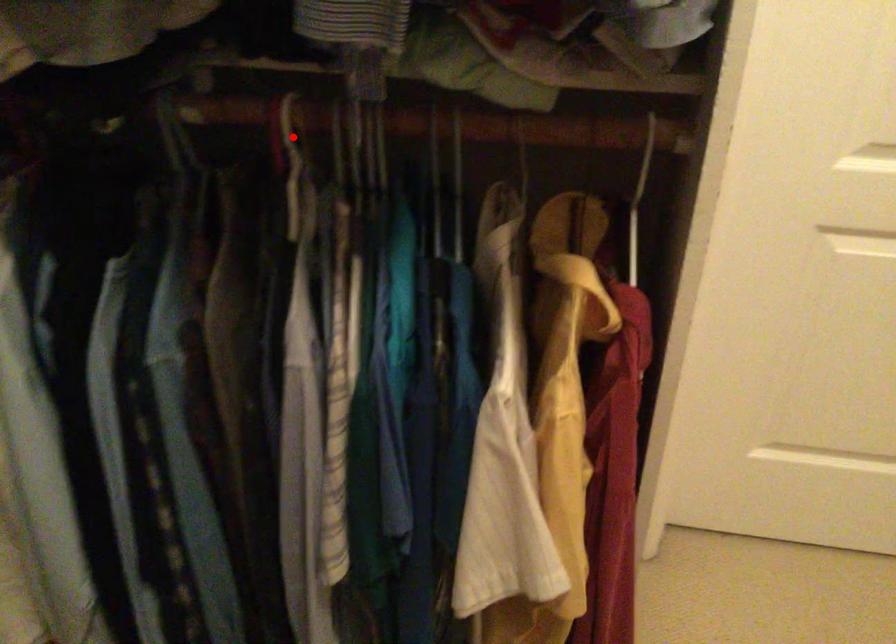
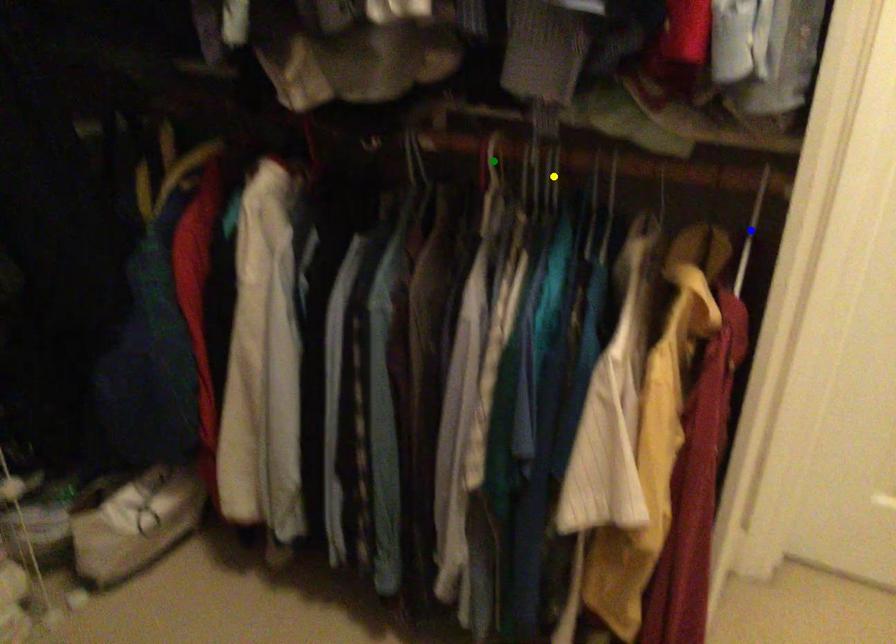
Question: I am providing you with two images of the same scene from different viewpoints. A red point is marked on the first image. You are given multiple points on the second image. Which point in image 2 is actually the same real-world point as the red point in image 1?

Choices:
 (A) green point
 (B) blue point
 (C) yellow point

Answer: (A)